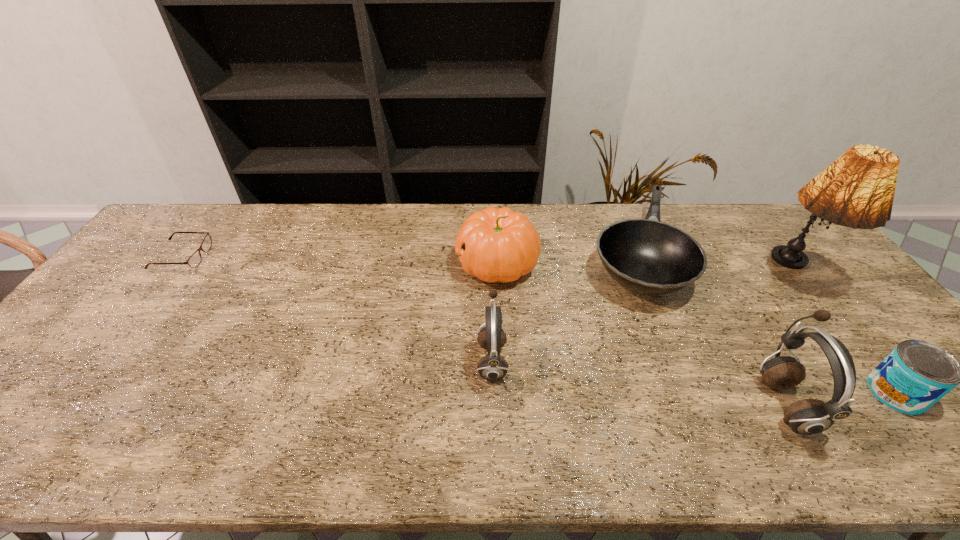
Find the location of a particular element. The image size is (960, 540). vacant space positioned on the front-facing side of the lampshade is located at coordinates (866, 372).

This screenshot has width=960, height=540. I want to click on vacant space located on the left of the can, so click(815, 393).

The width and height of the screenshot is (960, 540). I want to click on frying pan present at the far edge, so click(647, 256).

Locate an element on the screen. Image resolution: width=960 pixels, height=540 pixels. spectacles that is at the far edge is located at coordinates (194, 260).

This screenshot has height=540, width=960. I want to click on pumpkin that is at the far edge, so click(x=493, y=244).

You are a GUI agent. You are given a task and a screenshot of the screen. Output one action in this format:
    pyautogui.click(x=<x>, y=<y>)
    Task: Click on the can that is at the near edge
    The image size is (960, 540).
    Given the screenshot: What is the action you would take?
    pyautogui.click(x=916, y=374)

Locate an element on the screen. object that is at the left edge is located at coordinates (194, 260).

Identify the location of lampshade present at the right edge. (857, 190).

Where is `can that is at the right edge`? This screenshot has width=960, height=540. can that is at the right edge is located at coordinates (916, 374).

This screenshot has height=540, width=960. I want to click on object present at the far left corner, so click(x=194, y=260).